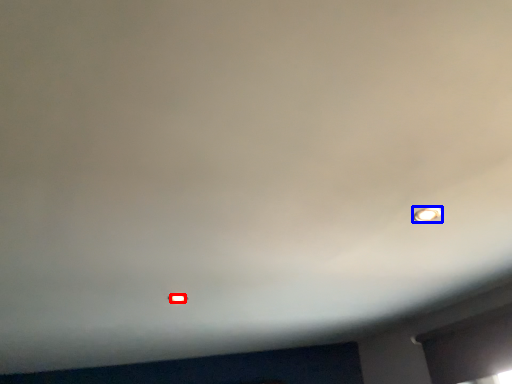
Question: Which point is further to the camera, light bulb (highlighted by a red box) or light bulb (highlighted by a blue box)?

Choices:
 (A) light bulb
 (B) light bulb

Answer: (A)